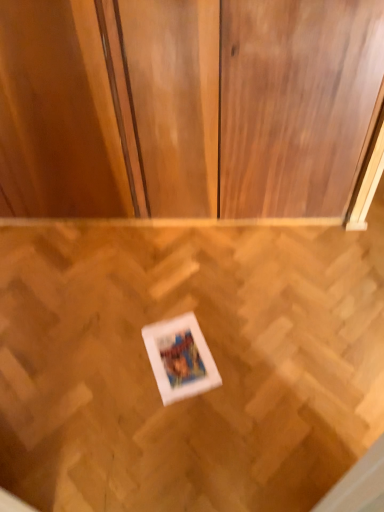
In order to click on vacant space to the left of white matte picture frame at center in this screenshot , I will do `click(114, 358)`.